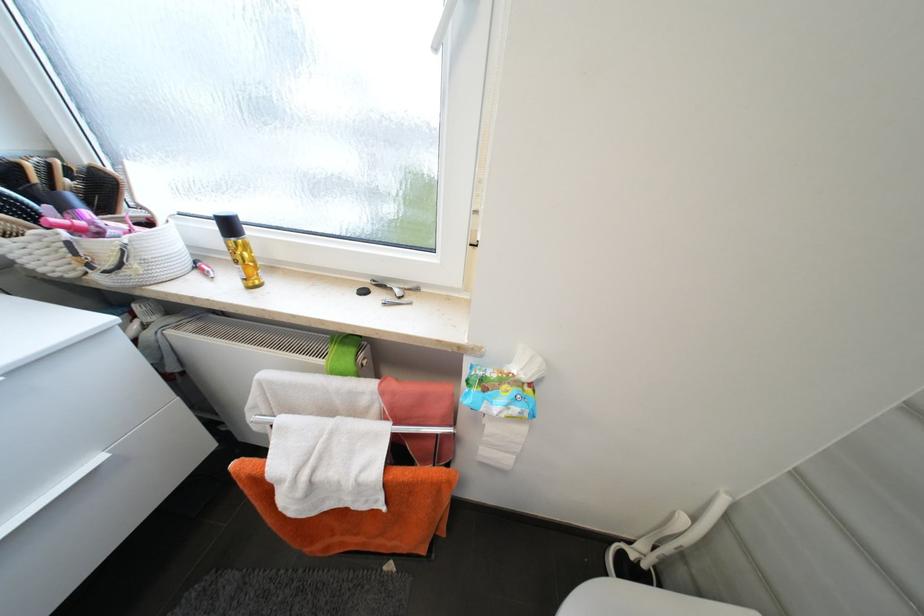
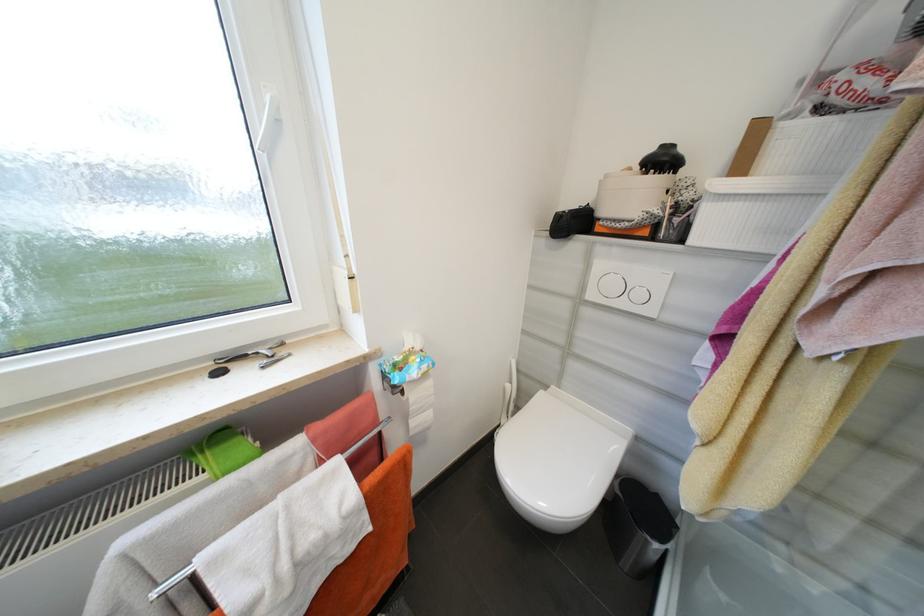
Question: The first image is from the beginning of the video and the second image is from the end. How did the camera likely rotate when shooting the video?

Choices:
 (A) Left
 (B) Right
 (C) Up
 (D) Down

Answer: (B)